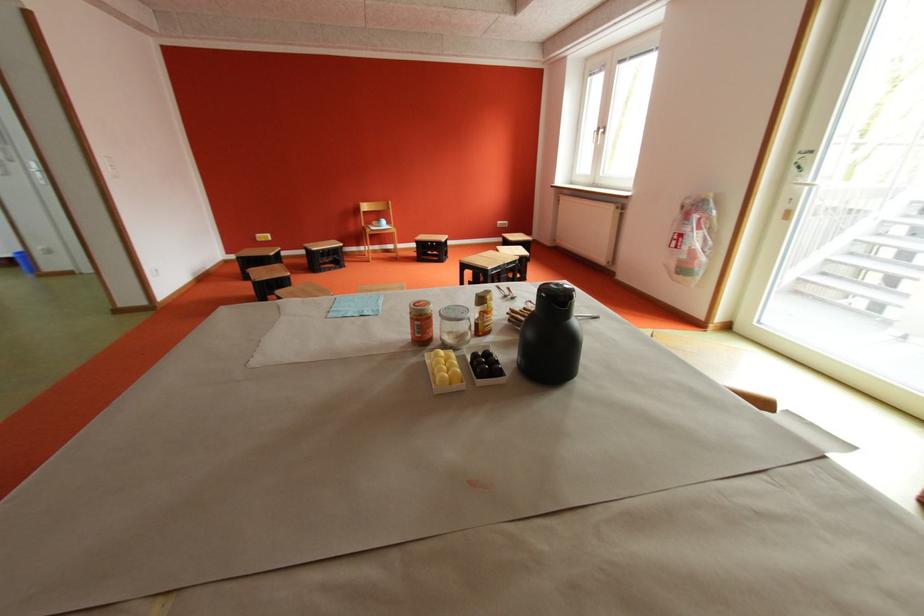
Identify the location of bottle cap. (482, 297).